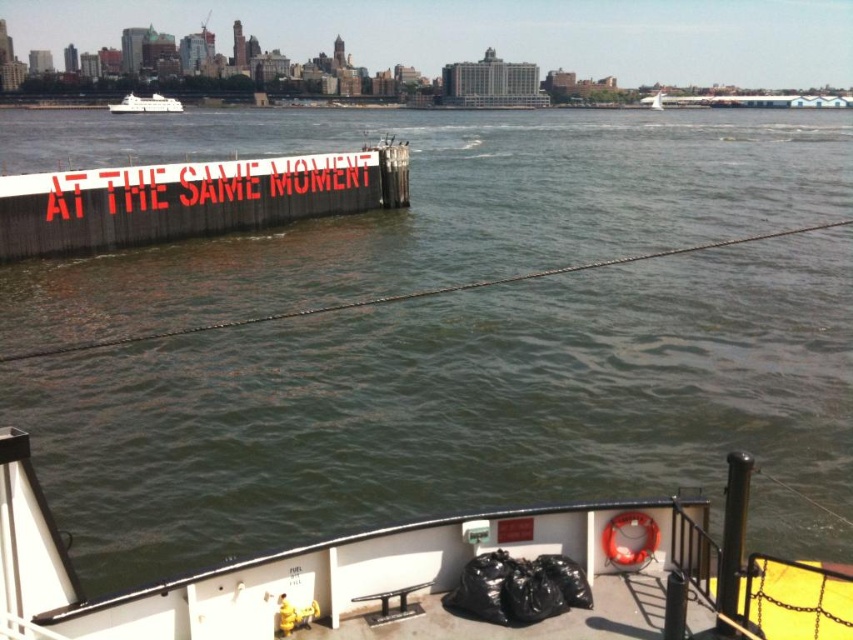
Question: Which of the following is the farthest from the observer?

Choices:
 (A) tap(451, 628)
 (B) tap(367, 189)
 (C) tap(125, 97)

Answer: (C)

Question: Which of the following is the farthest from the observer?

Choices:
 (A) (165, 221)
 (B) (144, 108)

Answer: (B)

Question: Considering the real-world distances, which object is farthest from the white painted wood sign at upper left?

Choices:
 (A) white glossy boat at upper left
 (B) white matte boat at lower center

Answer: (A)

Question: Is white matte boat at lower center positioned at the back of white glossy boat at upper left?

Choices:
 (A) yes
 (B) no

Answer: (B)

Question: Can you confirm if white matte boat at lower center is positioned below white glossy boat at upper left?

Choices:
 (A) yes
 (B) no

Answer: (A)

Question: Does white matte boat at lower center come behind white painted wood sign at upper left?

Choices:
 (A) yes
 (B) no

Answer: (B)